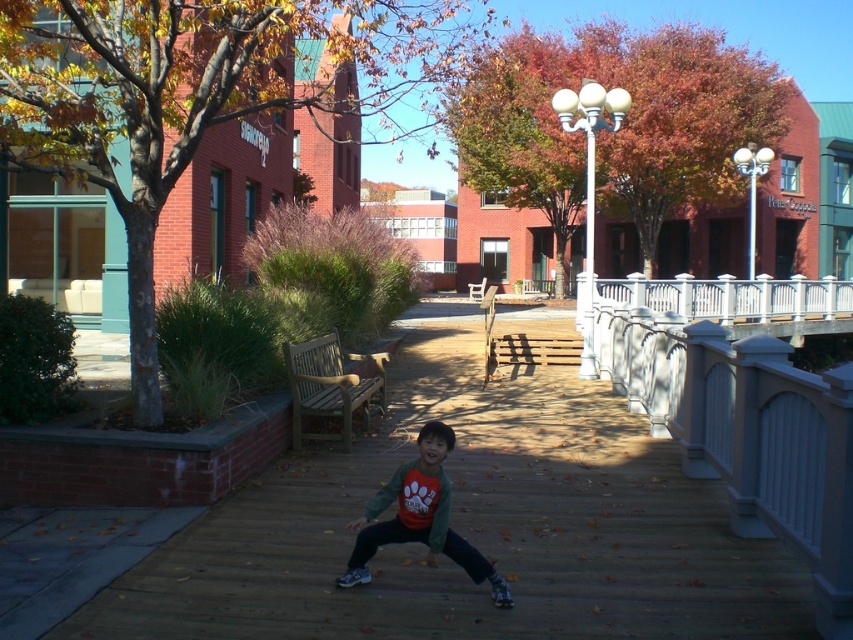
Can you confirm if matte green sweater at center is positioned above wooden bench at center?

No, matte green sweater at center is not above wooden bench at center.

Does matte green sweater at center appear on the right side of wooden bench at center?

Correct, you'll find matte green sweater at center to the right of wooden bench at center.

Locate an element on the screen. The width and height of the screenshot is (853, 640). matte green sweater at center is located at coordinates point(419,516).

Does white painted wood railing at right lie behind matte green sweater at center?

No, it is in front of matte green sweater at center.

Can you confirm if white painted wood railing at right is taller than matte green sweater at center?

Yes, white painted wood railing at right is taller than matte green sweater at center.

This screenshot has height=640, width=853. I want to click on white painted wood railing at right, so click(x=747, y=433).

Can you confirm if white painted wood railing at right is bigger than wooden bench at center?

Correct, white painted wood railing at right is larger in size than wooden bench at center.

Which is behind, point (672, 419) or point (296, 385)?

Positioned behind is point (672, 419).

Identify the location of white painted wood railing at right. (747, 433).